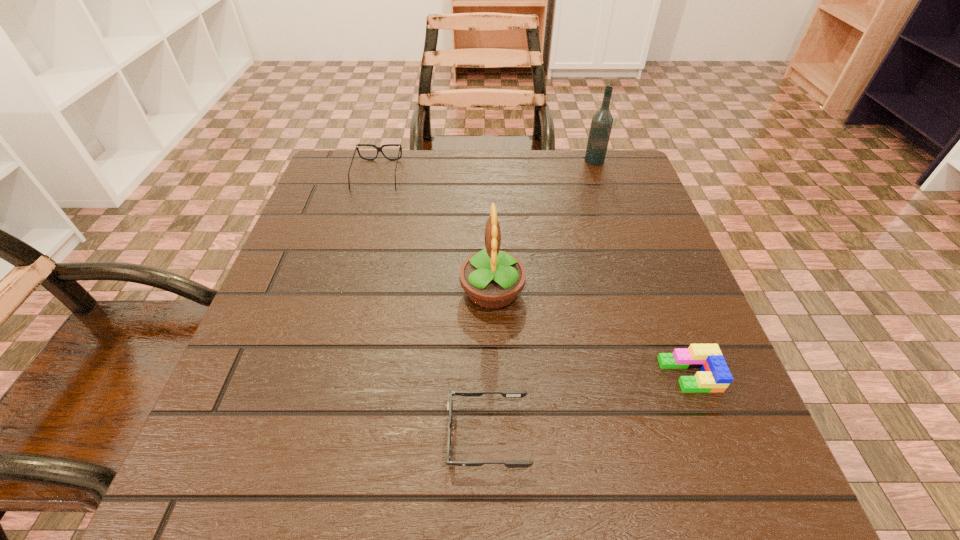
The width and height of the screenshot is (960, 540). In order to click on Lego located at the right edge in this screenshot , I will do `click(715, 376)`.

Find the location of `object that is at the far left corner`. object that is at the far left corner is located at coordinates (379, 149).

Image resolution: width=960 pixels, height=540 pixels. Identify the location of object located in the far right corner section of the desktop. (601, 125).

In the image, there is a desktop. Where is `vacant space at the far edge`? The height and width of the screenshot is (540, 960). vacant space at the far edge is located at coordinates (482, 152).

The image size is (960, 540). Identify the location of vacant space at the near edge of the desktop. (542, 488).

In the image, there is a desktop. Where is `free region at the left edge`? This screenshot has width=960, height=540. free region at the left edge is located at coordinates (349, 264).

At what (x,y) coordinates should I click in order to perform the action: click on vacant space at the right edge of the desktop. Please return your answer as a coordinate pair (x, y). The image size is (960, 540). Looking at the image, I should click on (672, 323).

Identify the location of vacant area at the far left corner. (368, 162).

At what (x,y) coordinates should I click in order to perform the action: click on vacant space at the far right corner of the desktop. Please return your answer as a coordinate pair (x, y). Image resolution: width=960 pixels, height=540 pixels. Looking at the image, I should click on (566, 154).

This screenshot has height=540, width=960. I want to click on vacant region at the near right corner of the desktop, so click(780, 501).